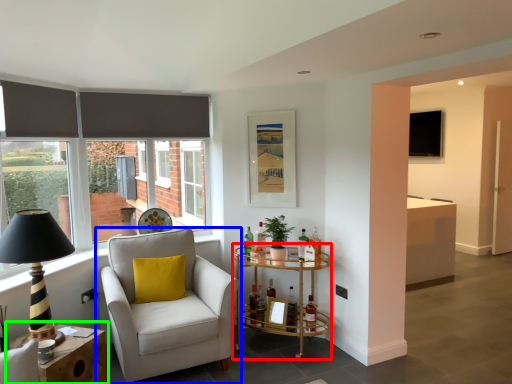
Question: Which object is positioned closest to table (highlighted by a red box)? Select from chair (highlighted by a blue box) and table (highlighted by a green box).

Choices:
 (A) chair
 (B) table

Answer: (A)